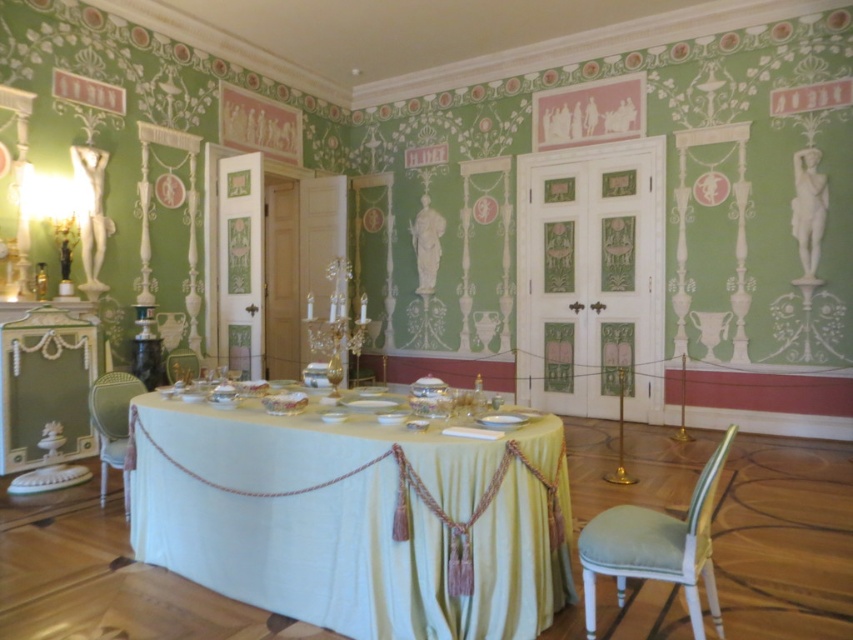
Based on the photo, you are standing at the entrance of the room and want to place a decorative vase on the white silk table at center. Based on the room layout, can you determine the exact coordinates where the table is located?

The white silk table at center is located at coordinates point (357, 518).

You are standing in the center of the room and want to move towards the point labeled point (531, 488). Which direction should you walk to avoid passing through point (180, 348)?

Since point (531, 488) is in front of point (180, 348), you should walk forward to reach point (531, 488) without passing through point (180, 348).